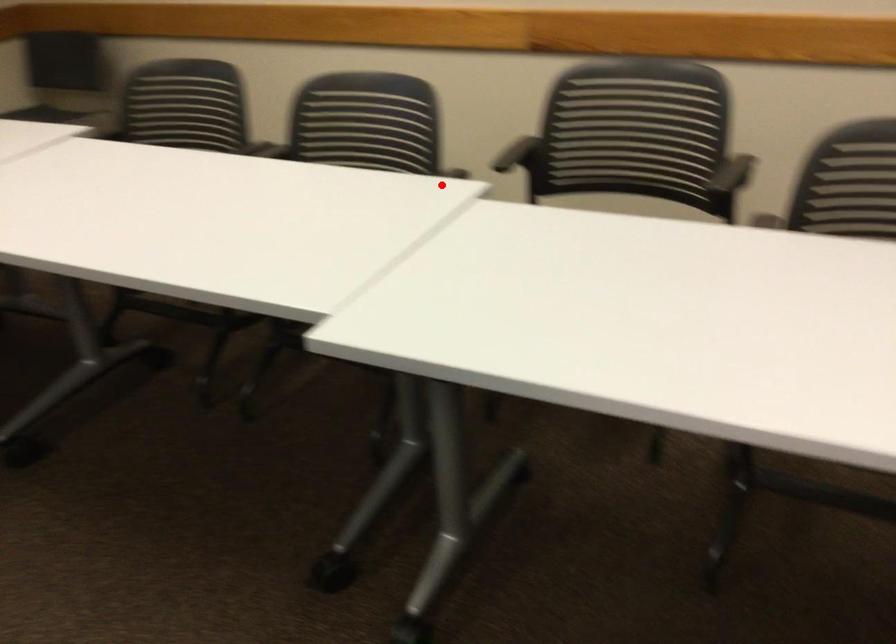
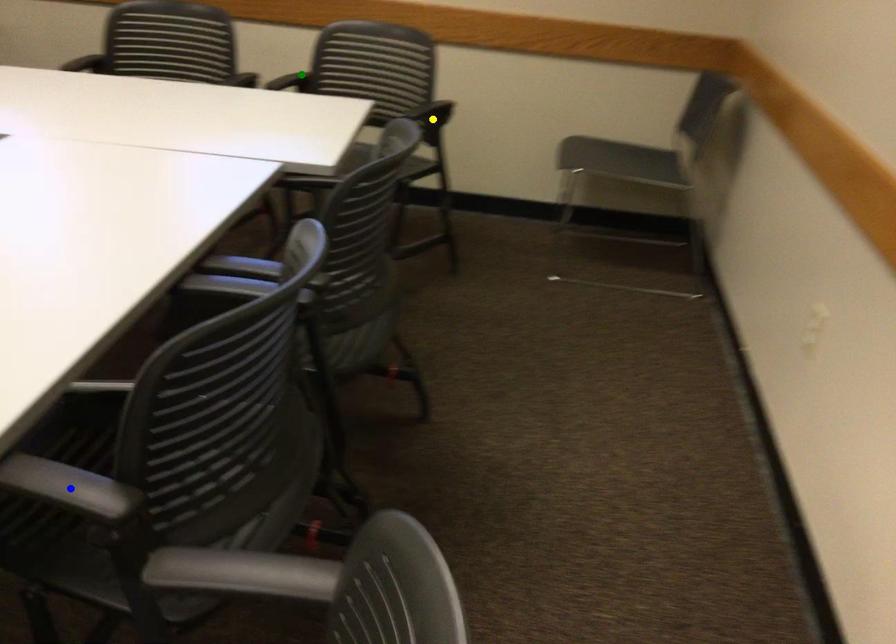
Question: I am providing you with two images of the same scene from different viewpoints. A red point is marked on the first image. You are given multiple points on the second image. Which point in image 2 is actually the same real-world point as the red point in image 1?

Choices:
 (A) yellow point
 (B) blue point
 (C) green point

Answer: (B)